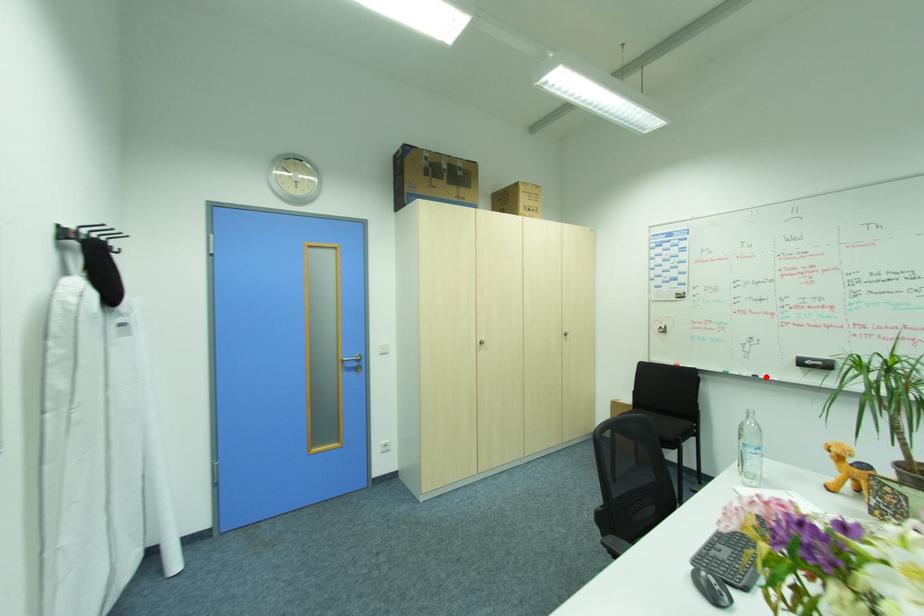
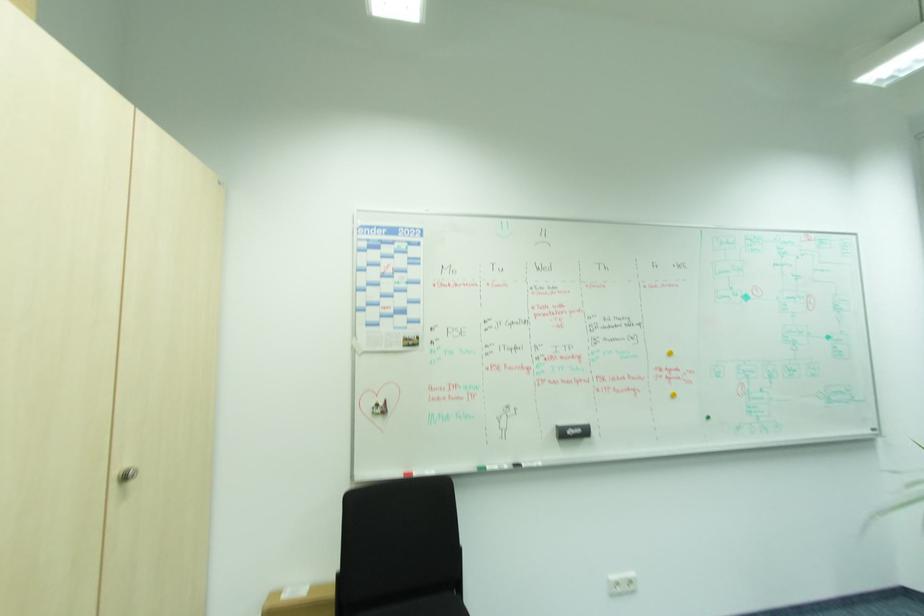
Question: A red point is marked in image1. In image2, is the corresponding 3D point closer to the camera or farther? Reply with the corresponding letter.

Choices:
 (A) The corresponding 3D point is closer.
 (B) The corresponding 3D point is farther.

Answer: (B)